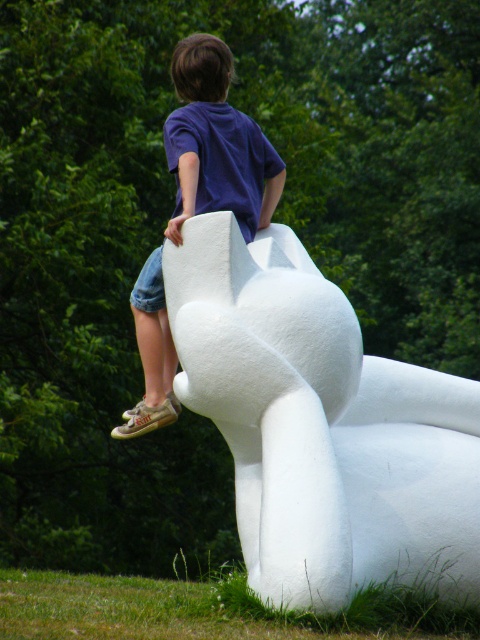
You are a photographer trying to capture a photo of the white matte sculpture at upper center and the matte blue shirt at upper center. Since you want to ensure both are in focus, you need to know their relative sizes. Which object is taller?

The white matte sculpture at upper center is taller than the matte blue shirt at upper center according to the description.

You are a photographer trying to capture the child in the scene. You want to position yourself so that the white matte sculpture at upper center and the matte blue shirt at upper center are both visible in the frame. Based on their positions, which side of the sculpture should you stand to ensure both objects are in view?

The white matte sculpture at upper center is to the right of the matte blue shirt at upper center. To include both in the frame, you should position yourself to the left side of the sculpture so that the sculpture and the shirt are both visible.

Based on the photo, you are a photographer trying to capture the child in the scene. Since you want to focus on the child, you need to ensure the white matte sculpture at upper center and the matte blue shirt at upper center are not overlapping. Given their sizes, which object should you move closer to the camera to prevent overlap?

Since the white matte sculpture at upper center is wider than the matte blue shirt at upper center, you should move the matte blue shirt at upper center closer to the camera to reduce its size in the frame and prevent overlap with the sculpture.